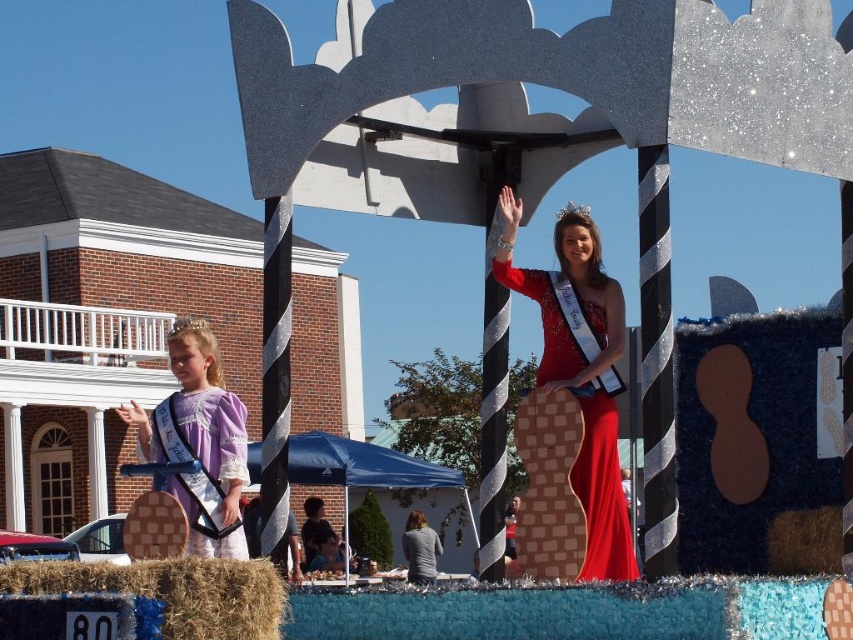
Between shiny red dress at center and brown straw bale at lower left, which one is positioned lower?

Positioned lower is brown straw bale at lower left.

Measure the distance between shiny red dress at center and camera.

shiny red dress at center and camera are 40.80 meters apart.

I want to click on shiny red dress at center, so tap(583, 432).

Who is more forward, (231, 419) or (585, 312)?

Point (585, 312)

Who is positioned more to the right, purple satin sash at center or shiny red dress at center?

From the viewer's perspective, shiny red dress at center appears more on the right side.

The width and height of the screenshot is (853, 640). What are the coordinates of `purple satin sash at center` in the screenshot? It's located at (199, 442).

Where is `purple satin sash at center`? Image resolution: width=853 pixels, height=640 pixels. purple satin sash at center is located at coordinates (199, 442).

What do you see at coordinates (199, 442) in the screenshot?
I see `purple satin sash at center` at bounding box center [199, 442].

Image resolution: width=853 pixels, height=640 pixels. I want to click on purple satin sash at center, so click(x=199, y=442).